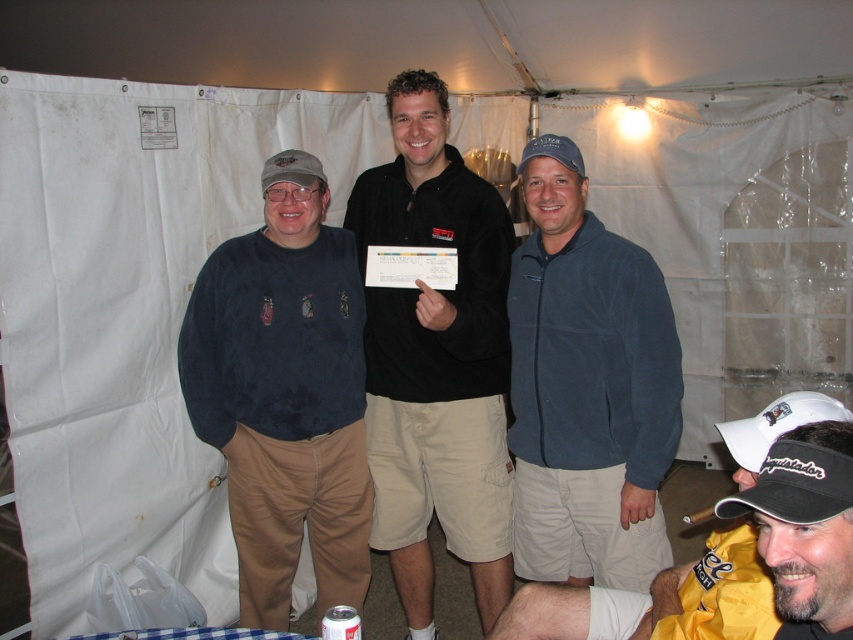
Question: Which point is farther to the camera?

Choices:
 (A) (293, 483)
 (B) (548, 140)

Answer: (A)

Question: Can you confirm if velvet blue jacket at center is thinner than black cap at lower right?

Choices:
 (A) no
 (B) yes

Answer: (A)

Question: Which of the following is the farthest from the observer?

Choices:
 (A) dark blue fleece at center
 (B) black fleece jacket at center
 (C) yellow fabric jacket at lower right
 (D) velvet blue jacket at center

Answer: (A)

Question: Which object is farther from the camera taking this photo?

Choices:
 (A) velvet blue jacket at center
 (B) dark blue fleece at center
 (C) yellow fabric jacket at lower right
 (D) black fleece jacket at center

Answer: (B)

Question: Is velvet blue jacket at center closer to camera compared to black cap at lower right?

Choices:
 (A) no
 (B) yes

Answer: (A)

Question: Can you confirm if dark blue fleece at center is positioned below velvet blue jacket at center?

Choices:
 (A) no
 (B) yes

Answer: (B)